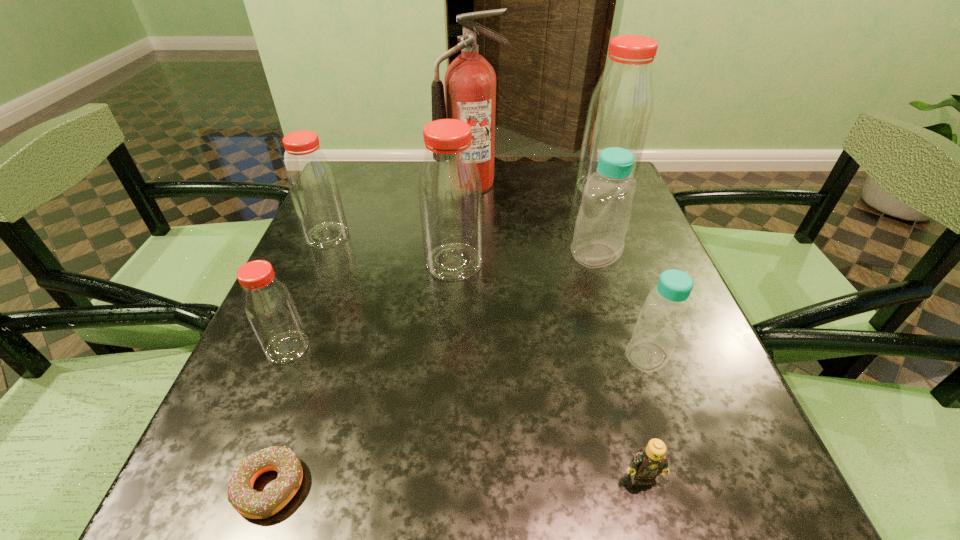
This screenshot has width=960, height=540. Find the location of `fire extinguisher`. fire extinguisher is located at coordinates (470, 81).

Where is `the rightmost red bottle`? the rightmost red bottle is located at coordinates (619, 114).

Where is `the biggest red bottle`? This screenshot has height=540, width=960. the biggest red bottle is located at coordinates (619, 114).

You are a GUI agent. You are given a task and a screenshot of the screen. Output one action in this format:
    pyautogui.click(x=<x>, y=<y>)
    Task: Click on the second red bottle from right to left
    The width and height of the screenshot is (960, 540).
    Given the screenshot: What is the action you would take?
    pyautogui.click(x=450, y=195)

Find the location of a particular element. The image size is (960, 540). the second tallest bottle is located at coordinates (450, 195).

Identify the location of the farther blue bottle. This screenshot has width=960, height=540. (604, 214).

Identify the location of the third biggest red bottle. pos(313,187).

Where is `the smallest red bottle`? the smallest red bottle is located at coordinates (271, 311).

Image resolution: width=960 pixels, height=540 pixels. Find the location of `the nearer blue bottle`. the nearer blue bottle is located at coordinates point(665,310).

This screenshot has height=540, width=960. In order to click on tan Lego in this screenshot , I will do `click(650, 461)`.